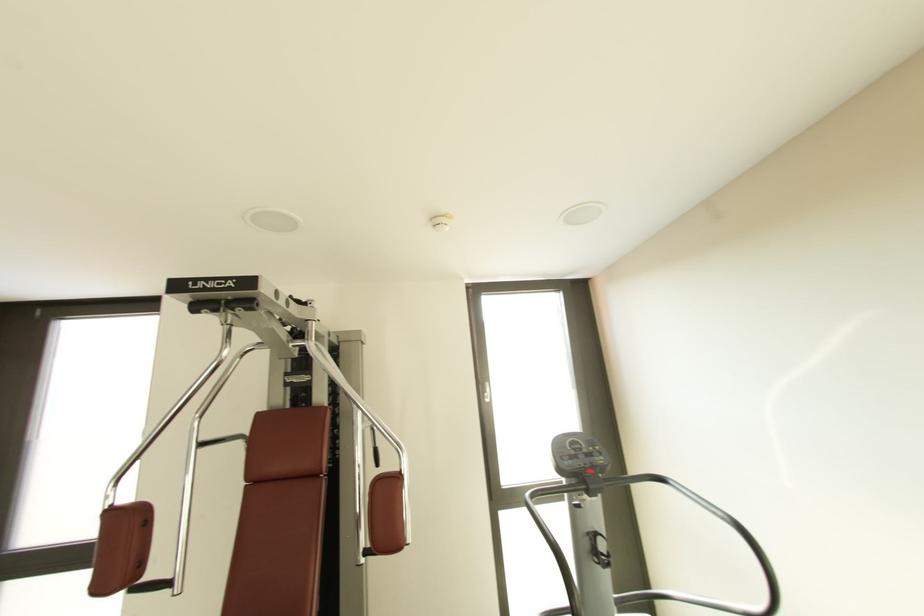
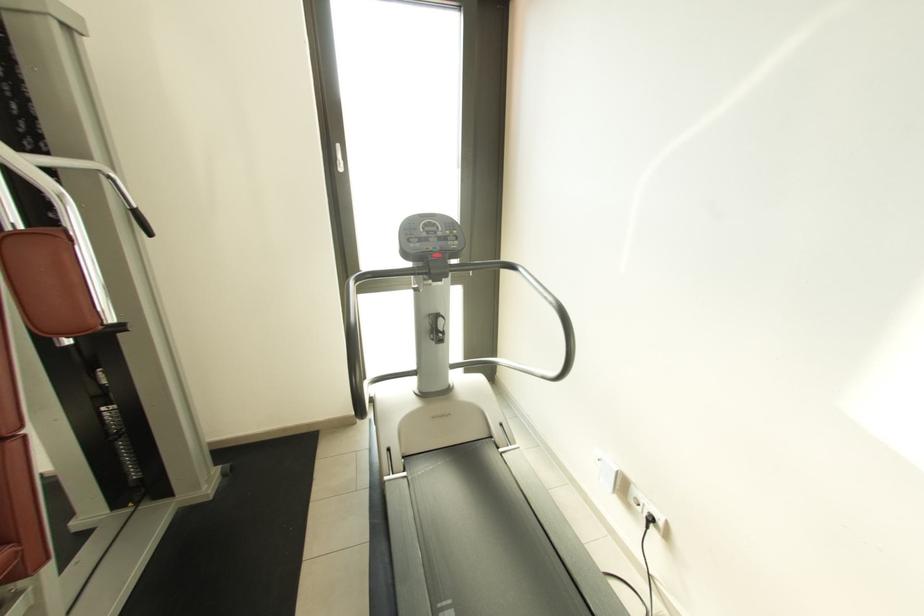
Question: The first image is from the beginning of the video and the second image is from the end. How did the camera likely rotate when shooting the video?

Choices:
 (A) Left
 (B) Right
 (C) Up
 (D) Down

Answer: (D)